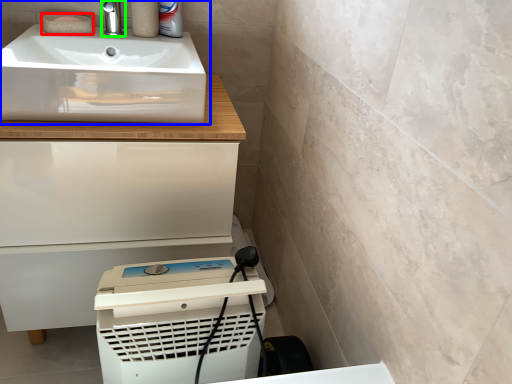
Question: Which object is the closest to the soap (highlighted by a red box)? Choose among these: sink (highlighted by a blue box) or tap (highlighted by a green box).

Choices:
 (A) sink
 (B) tap

Answer: (B)